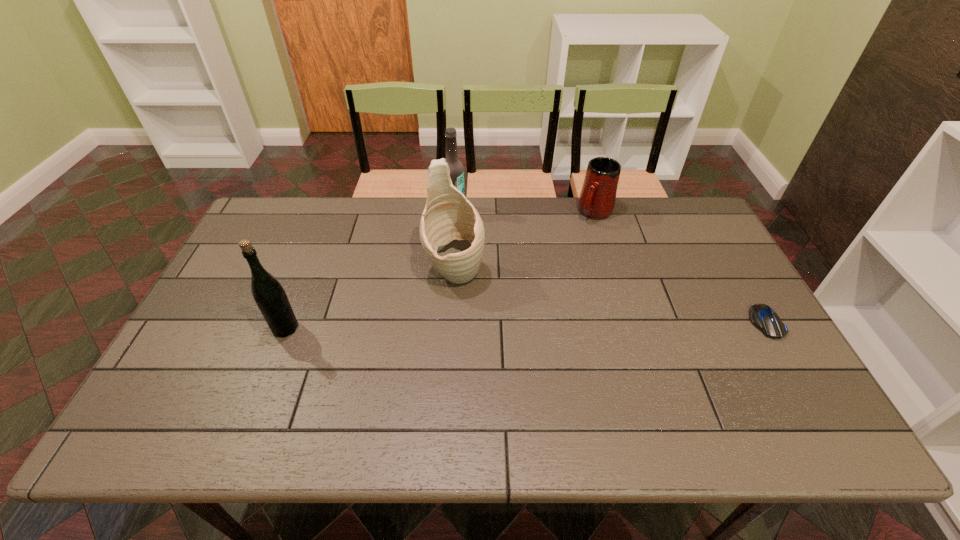
Identify the location of vacant space situated on the button side of the rightmost object. The image size is (960, 540). (798, 377).

Locate an element on the screen. The height and width of the screenshot is (540, 960). vacant region located 0.220m on the label of the right beer bottle is located at coordinates (491, 253).

You are a GUI agent. You are given a task and a screenshot of the screen. Output one action in this format:
    pyautogui.click(x=<x>, y=<y>)
    Task: Click on the free point located 0.130m on the label of the right beer bottle
    This screenshot has height=540, width=960.
    Given the screenshot: What is the action you would take?
    pyautogui.click(x=477, y=237)

The height and width of the screenshot is (540, 960). What are the coordinates of `free space located 0.300m on the label of the right beer bottle` in the screenshot? It's located at (504, 269).

Identify the location of vacant space situated 0.080m on the side of the fourth tallest object with the handle. The image size is (960, 540). point(579,237).

Where is `vacant space situated 0.330m on the side of the fourth tallest object with the handle`? The image size is (960, 540). vacant space situated 0.330m on the side of the fourth tallest object with the handle is located at coordinates (543, 282).

Image resolution: width=960 pixels, height=540 pixels. In order to click on vacant space located on the side of the fourth tallest object with the handle in this screenshot , I will do `click(575, 241)`.

The width and height of the screenshot is (960, 540). Identify the location of blank space located at the spout of the third nearest object. (490, 386).

Locate an element on the screen. vacant space located at the spout of the third nearest object is located at coordinates (477, 346).

Where is `vacant area situated 0.110m at the spout of the third nearest object`? This screenshot has width=960, height=540. vacant area situated 0.110m at the spout of the third nearest object is located at coordinates (470, 325).